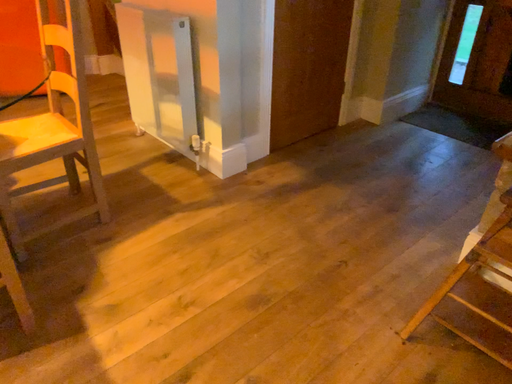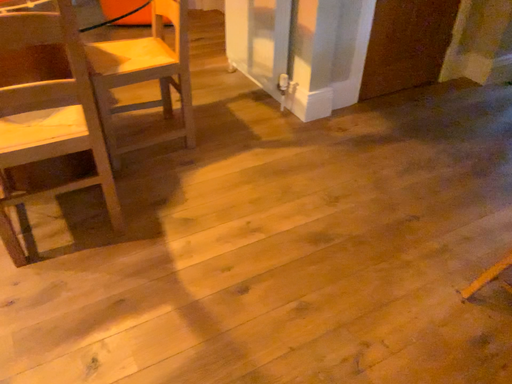
Question: How did the camera likely rotate when shooting the video?

Choices:
 (A) rotated right
 (B) rotated left

Answer: (B)